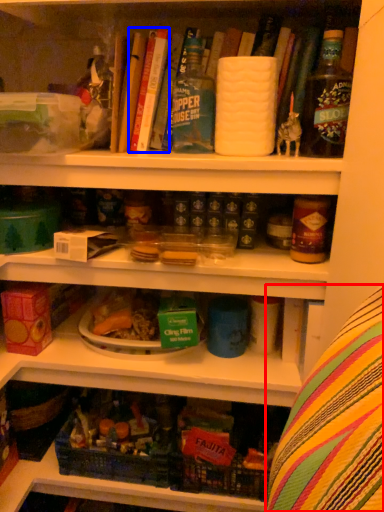
Question: Which object is further to the camera taking this photo, leftover (highlighted by a red box) or book (highlighted by a blue box)?

Choices:
 (A) leftover
 (B) book

Answer: (B)